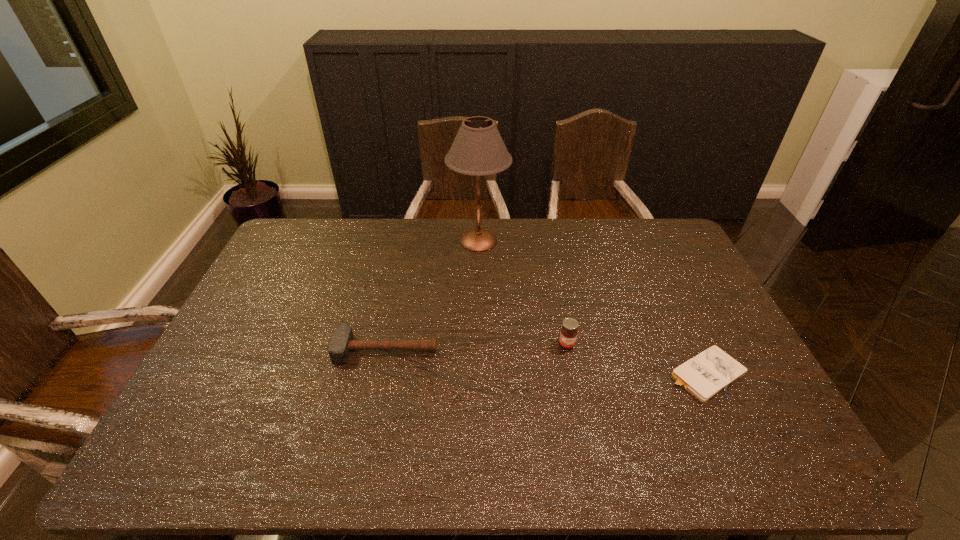
The image size is (960, 540). I want to click on free location located 0.100m on the striking surface of the second shortest object, so click(x=376, y=396).

In order to click on vacant region located 0.400m on the left of the shortest object in this screenshot , I will do `click(514, 374)`.

Locate an element on the screen. object that is at the far edge is located at coordinates (478, 149).

Find the location of a particular element. object located in the right edge section of the desktop is located at coordinates tap(704, 376).

Image resolution: width=960 pixels, height=540 pixels. In the image, there is a desktop. In order to click on vacant region at the far edge in this screenshot , I will do coord(588,235).

I want to click on free space at the near edge of the desktop, so click(x=425, y=462).

This screenshot has height=540, width=960. I want to click on free point at the left edge, so click(247, 347).

Find the location of a particular element. vacant space at the far right corner of the desktop is located at coordinates (677, 235).

This screenshot has height=540, width=960. I want to click on unoccupied position between the third tallest object and the shortest object, so (545, 361).

Locate an element on the screen. Image resolution: width=960 pixels, height=540 pixels. free space between the hammer and the notebook is located at coordinates (545, 361).